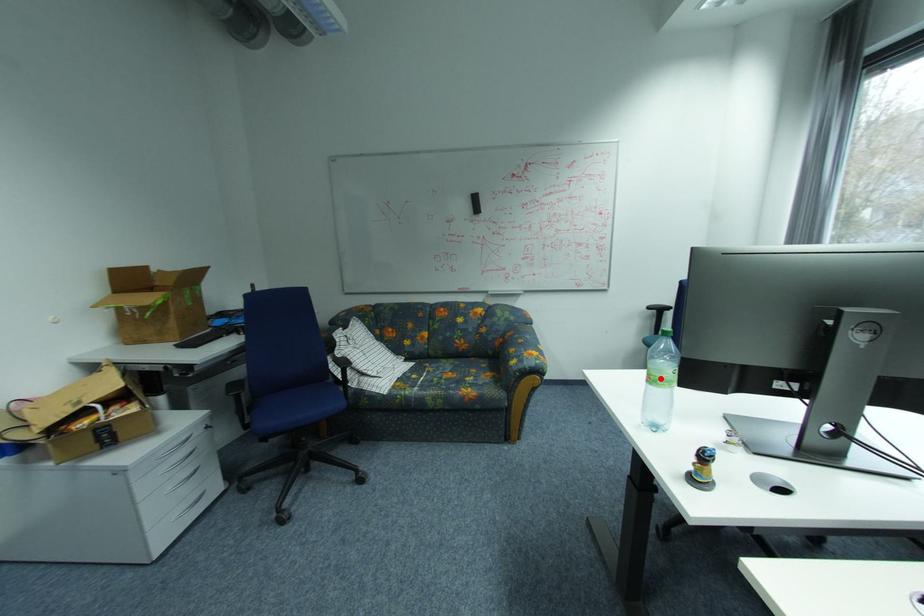
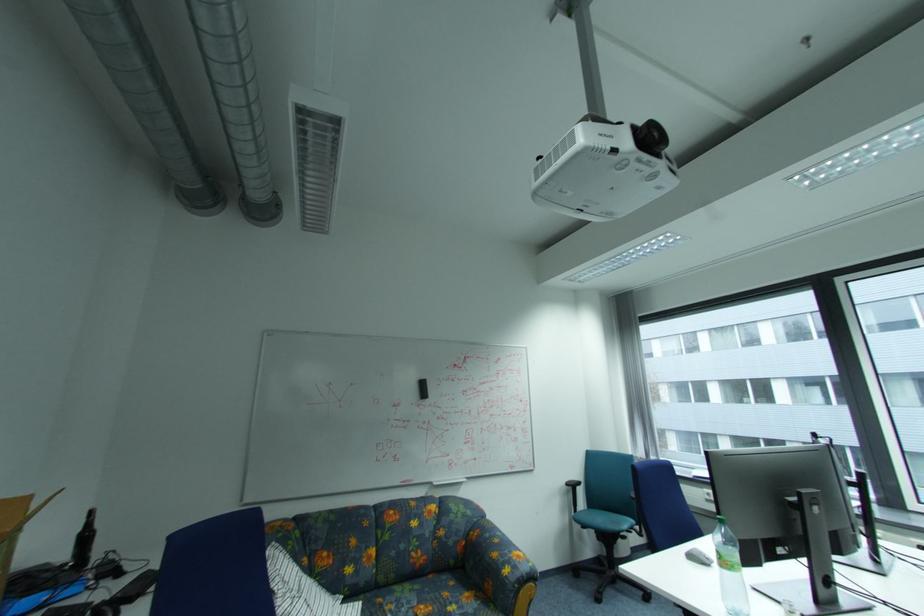
Question: A red point is marked in image1. In image2, is the corresponding 3D point closer to the camera or farther? Reply with the corresponding letter.

Choices:
 (A) The corresponding 3D point is closer.
 (B) The corresponding 3D point is farther.

Answer: (A)